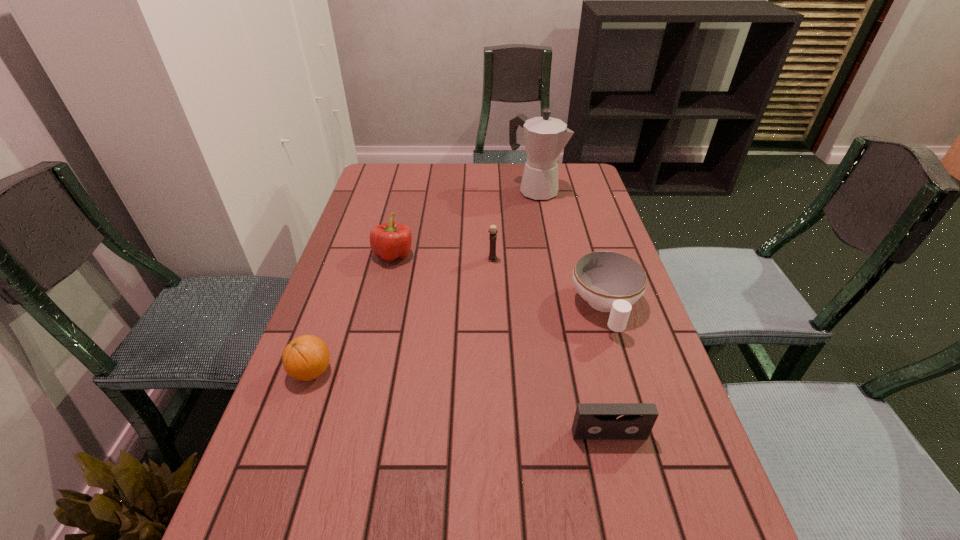
In order to click on vacant space that's between the fourth object from right to left and the second object from left to right in this screenshot , I will do `click(444, 257)`.

I want to click on free spot between the bell pepper and the chinaware, so click(499, 281).

Image resolution: width=960 pixels, height=540 pixels. Identify the location of vacant space in between the chinaware and the coffeepot. (570, 249).

Where is `unoccupied area between the second nearest object and the chinaware`? This screenshot has height=540, width=960. unoccupied area between the second nearest object and the chinaware is located at coordinates (459, 339).

Identify which object is located as the nearest to the videotape. Please provide its 2D coordinates. Your answer should be formatted as a tuple, i.e. [(x, y)], where the tuple contains the x and y coordinates of a point satisfying the conditions above.

[(611, 282)]

Select which object is the closest to the candle holder. Please provide its 2D coordinates. Your answer should be formatted as a tuple, i.e. [(x, y)], where the tuple contains the x and y coordinates of a point satisfying the conditions above.

[(611, 282)]

Identify the location of vacant position in the image that satisfies the following two spatial constraints: 1. on the back side of the bell pepper; 2. on the left side of the leftmost object. (352, 255).